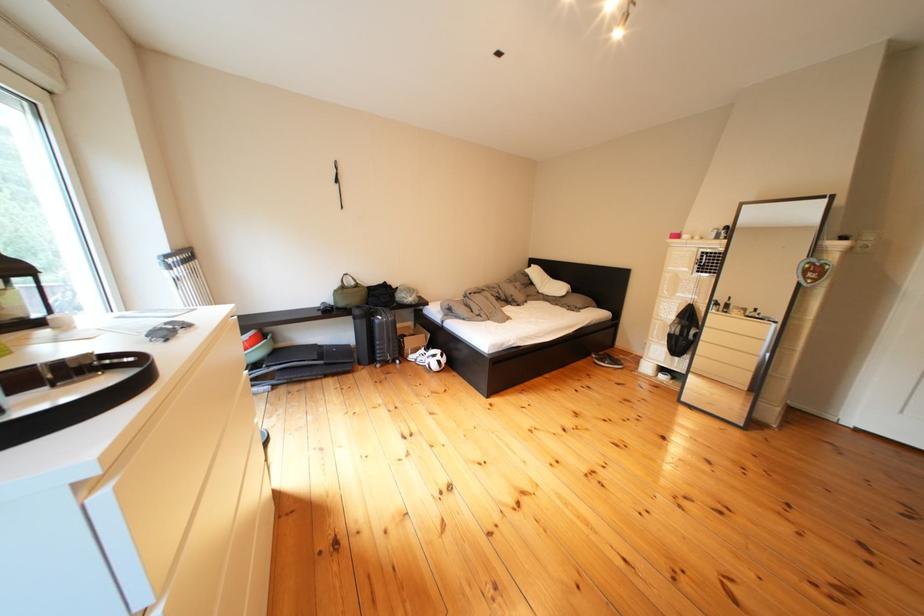
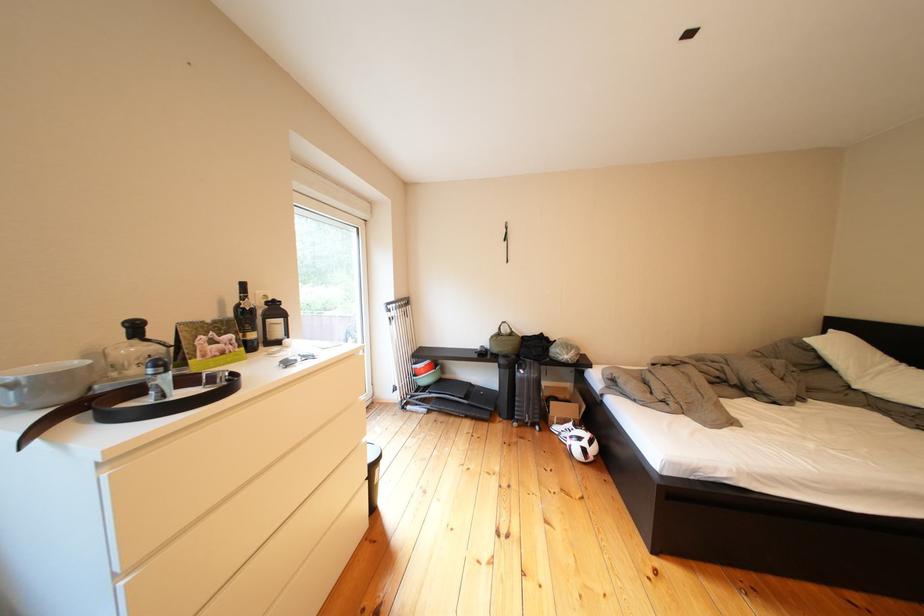
Locate, in the second image, the point that corresponds to pixel 371 317 in the first image.

(516, 366)